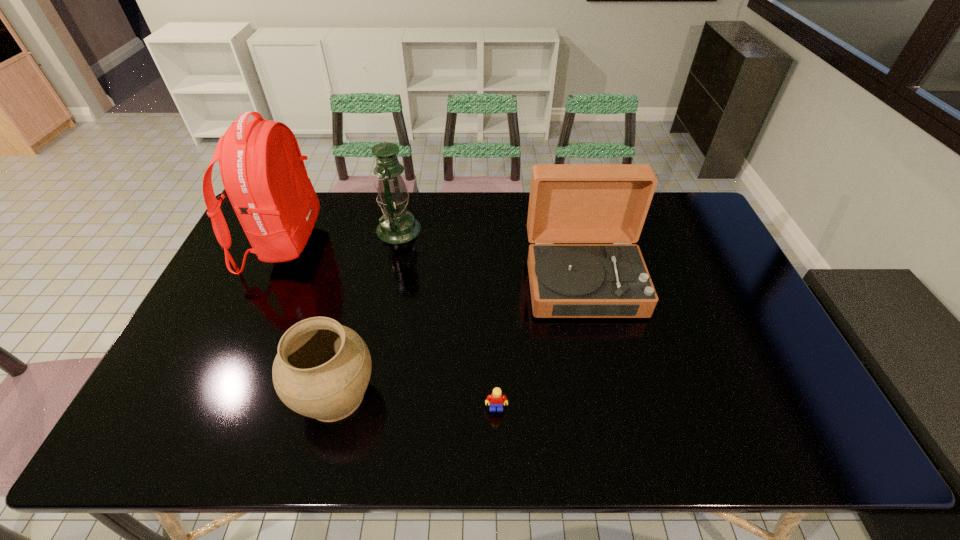
You are a GUI agent. You are given a task and a screenshot of the screen. Output one action in this format:
    pyautogui.click(x=<x>, y=<y>)
    Task: Click on the free location at the near left corner
    Image resolution: width=960 pixels, height=540 pixels.
    Given the screenshot: What is the action you would take?
    pyautogui.click(x=194, y=416)

In order to click on vacant area at the far right corner of the desktop in this screenshot , I will do `click(660, 223)`.

Where is `vacant space at the near right corner`? The width and height of the screenshot is (960, 540). vacant space at the near right corner is located at coordinates (817, 439).

This screenshot has width=960, height=540. What are the coordinates of `free space between the phonograph record and the oil lamp` in the screenshot? It's located at (491, 255).

At what (x,y) coordinates should I click in order to perform the action: click on free point between the phonograph record and the oil lamp. Please return your answer as a coordinate pair (x, y). The width and height of the screenshot is (960, 540). Looking at the image, I should click on (491, 255).

What are the coordinates of `vacant area that lies between the Lego and the oil lamp` in the screenshot? It's located at (447, 319).

Locate an element on the screen. The height and width of the screenshot is (540, 960). free space between the Lego and the fourth tallest object is located at coordinates (416, 402).

Find the location of a particular element. empty space that is in between the backpack and the shortest object is located at coordinates (390, 326).

Where is `vacant area that lies between the rightmost object and the shortest object`? This screenshot has width=960, height=540. vacant area that lies between the rightmost object and the shortest object is located at coordinates (540, 345).

At what (x,y) coordinates should I click in order to perform the action: click on vacant space that's between the second object from right to left and the tallest object. Please return your answer as a coordinate pair (x, y). This screenshot has width=960, height=540. Looking at the image, I should click on (390, 326).